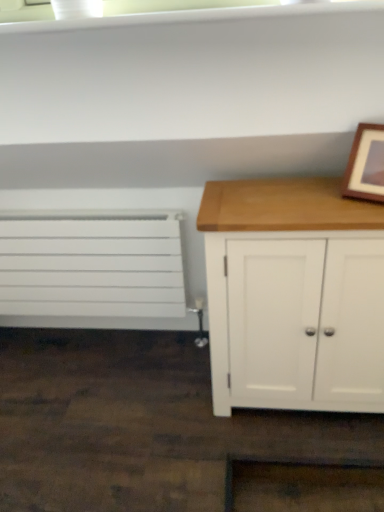
At what (x,y) coordinates should I click in order to perform the action: click on free space between white wood cabinet at right and white matte radiator at left. Please return your answer as a coordinate pair (x, y). The height and width of the screenshot is (512, 384). Looking at the image, I should click on (127, 368).